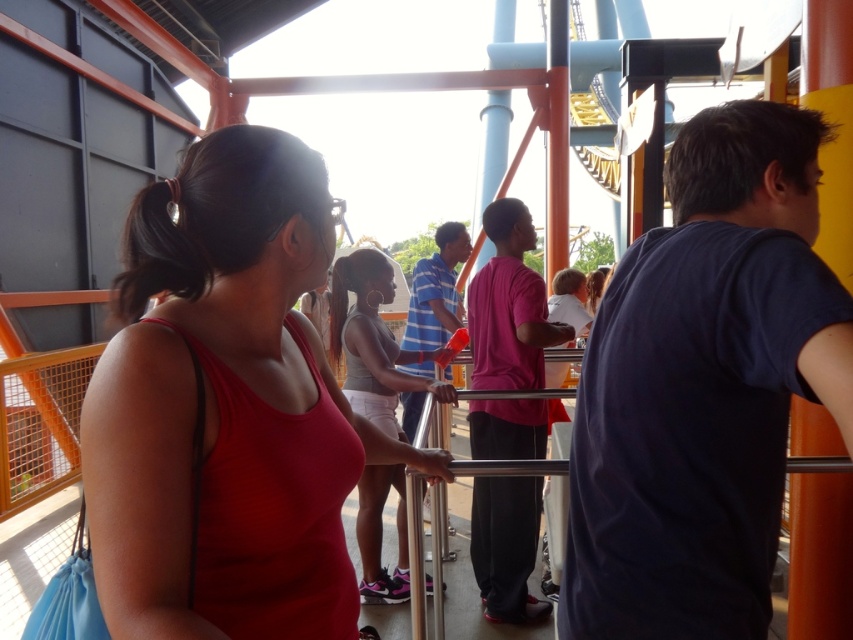
You are a photographer trying to capture both the matte red tank top at center and the gray fabric tank top at center in the same frame. Which person should you position closer to the camera to ensure both are fully visible?

To ensure both the matte red tank top at center and the gray fabric tank top at center are fully visible in the frame, you should position the person wearing the matte red tank top at center closer to the camera since it has a lesser height compared to the gray fabric tank top at center.

You are a photographer trying to capture both the matte red tank top at center and the gray fabric tank top at center in a single frame. Based on their sizes, which one should you focus on to ensure both fit clearly in the photo?

The matte red tank top at center is smaller than the gray fabric tank top at center, so you should focus on the gray fabric tank top at center to ensure both fit clearly in the photo.